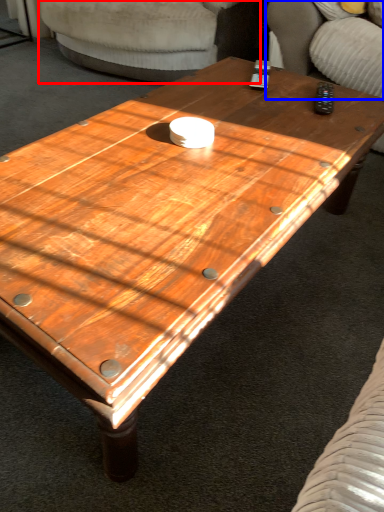
Question: Among these objects, which one is farthest to the camera, armchair (highlighted by a red box) or armchair (highlighted by a blue box)?

Choices:
 (A) armchair
 (B) armchair

Answer: (A)